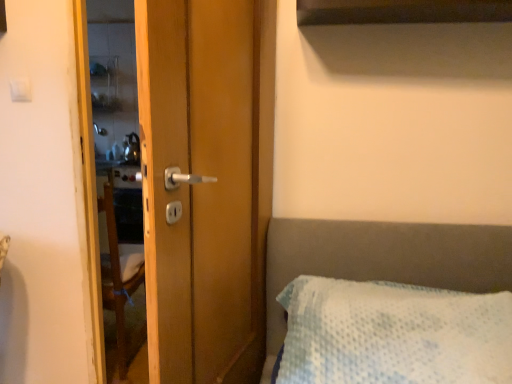
Question: Considering the positions of point click(17, 84) and point click(249, 44), is point click(17, 84) closer or farther from the camera than point click(249, 44)?

Choices:
 (A) closer
 (B) farther

Answer: (B)

Question: Is white plastic light switch at upper left taller or shorter than wooden door handle at center?

Choices:
 (A) short
 (B) tall

Answer: (A)

Question: Considering the positions of white plastic light switch at upper left and wooden door handle at center in the image, is white plastic light switch at upper left bigger or smaller than wooden door handle at center?

Choices:
 (A) big
 (B) small

Answer: (B)

Question: From the image's perspective, is wooden door handle at center above or below white plastic light switch at upper left?

Choices:
 (A) above
 (B) below

Answer: (B)

Question: From a real-world perspective, is wooden door handle at center positioned above or below white plastic light switch at upper left?

Choices:
 (A) below
 (B) above

Answer: (A)

Question: Visually, is wooden door handle at center positioned to the left or to the right of white plastic light switch at upper left?

Choices:
 (A) left
 (B) right

Answer: (B)

Question: In the image, is wooden door handle at center positioned in front of or behind white plastic light switch at upper left?

Choices:
 (A) front
 (B) behind

Answer: (A)